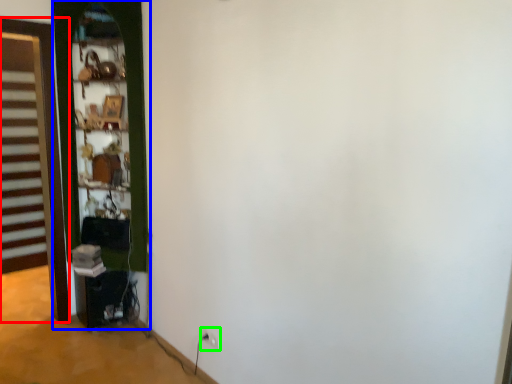
Question: Estimate the real-world distances between objects in this image. Which object is closer to door (highlighted by a red box), door (highlighted by a blue box) or electric outlet (highlighted by a green box)?

Choices:
 (A) door
 (B) electric outlet

Answer: (A)